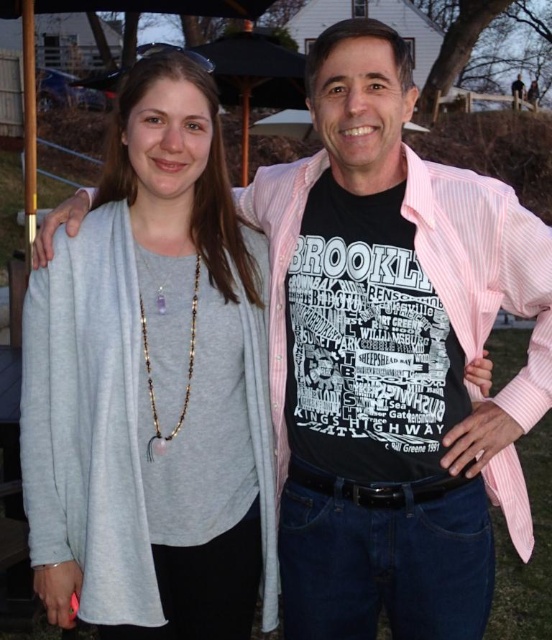
Can you confirm if gray soft sweater at center is shorter than amber beaded necklace at center?

In fact, gray soft sweater at center may be taller than amber beaded necklace at center.

Measure the distance between point (86, 314) and camera.

Point (86, 314) and camera are 1.89 meters apart.

The height and width of the screenshot is (640, 552). I want to click on gray soft sweater at center, so 152,385.